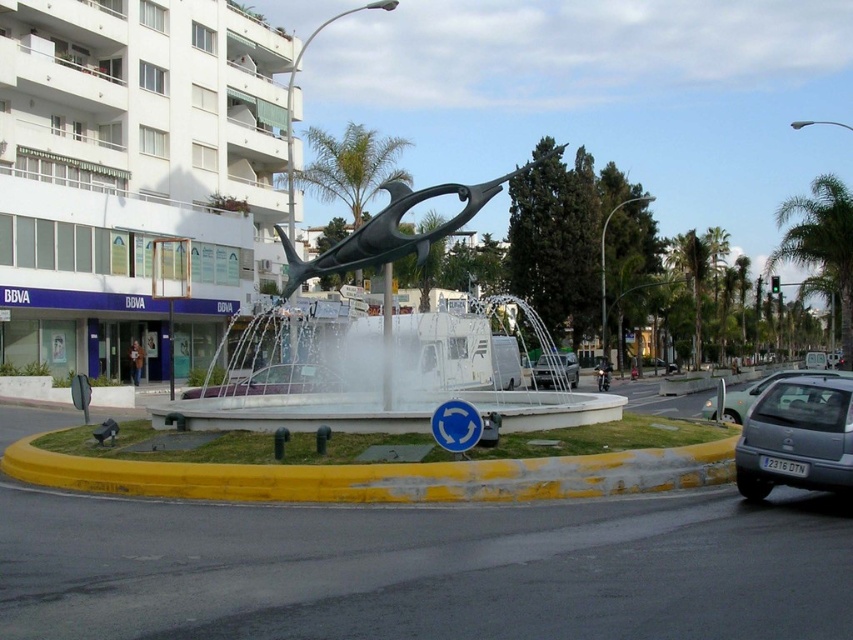
You are a delivery person trying to unload a package from your silver metallic sedan at right. The yellow concrete curb at lower center is where you need to place the package. Considering their heights, will the package rest stably on the curb?

The yellow concrete curb at lower center has a lesser height compared to the silver metallic sedan at right. Since the curb is shorter, the package might not rest stably as it could easily slide off the edge. It would be safer to place it on the ground beside the curb.

You are standing at the center of the roundabout and looking towards the BBVA building. There are two points marked on the ground in front of you at coordinates point (798,394) and point (543,387). Which point is closer to your current position?

Point (798,394) is closer to the viewer than point (543,387), so the point at (798,394) is closer to your current position.

You are driving a car and approaching the roundabout. You see the yellow concrete curb at lower center and the silver metallic sedan at right. Which object is positioned higher in the image?

The yellow concrete curb at lower center is above the silver metallic sedan at right, meaning it is positioned higher in the image.